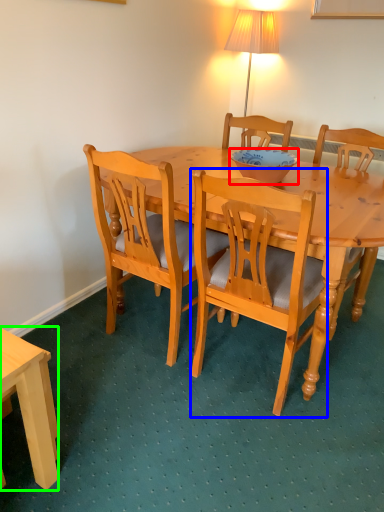
Question: Based on their relative distances, which object is nearer to bowl (highlighted by a red box)? Choose from chair (highlighted by a blue box) and desk (highlighted by a green box).

Choices:
 (A) chair
 (B) desk

Answer: (A)